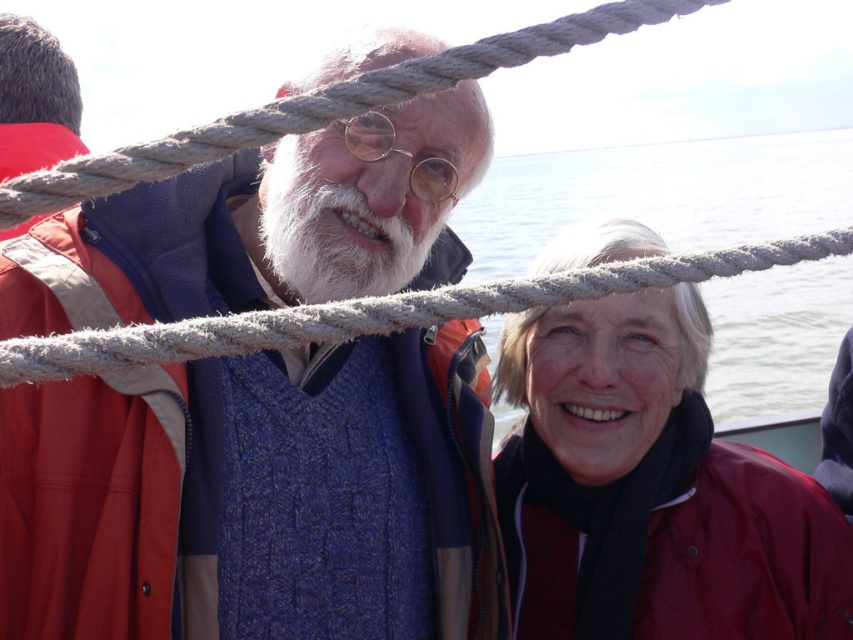
Question: Which point is closer to the camera?

Choices:
 (A) (741, 472)
 (B) (843, 540)
 (C) (752, 371)

Answer: (B)

Question: Which object appears closest to the camera in this image?

Choices:
 (A) burgundy fabric life jacket at lower right
 (B) blue knitted sweater at center
 (C) matte red jacket at right
 (D) clear water at upper center

Answer: (D)

Question: Can you confirm if clear water at upper center is positioned to the right of burgundy fabric life jacket at lower right?

Choices:
 (A) yes
 (B) no

Answer: (A)

Question: Estimate the real-world distances between objects in this image. Which object is farther from the matte red jacket at right?

Choices:
 (A) clear water at upper center
 (B) burgundy fabric life jacket at lower right
 (C) blue knitted sweater at center

Answer: (A)

Question: Can you confirm if blue knitted sweater at center is smaller than burgundy fabric life jacket at lower right?

Choices:
 (A) yes
 (B) no

Answer: (B)

Question: Does matte red jacket at right have a lesser width compared to burgundy fabric life jacket at lower right?

Choices:
 (A) yes
 (B) no

Answer: (B)